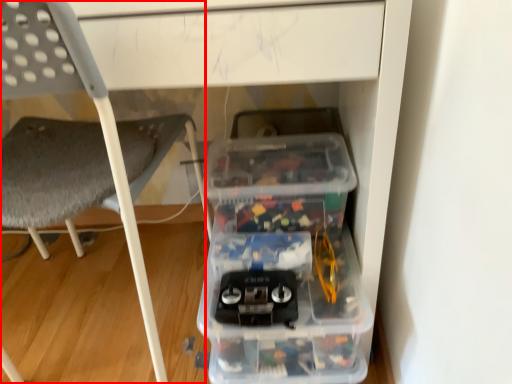
Question: From the image's perspective, where is chair (annotated by the red box) located in relation to storage box in the image?

Choices:
 (A) below
 (B) above

Answer: (B)